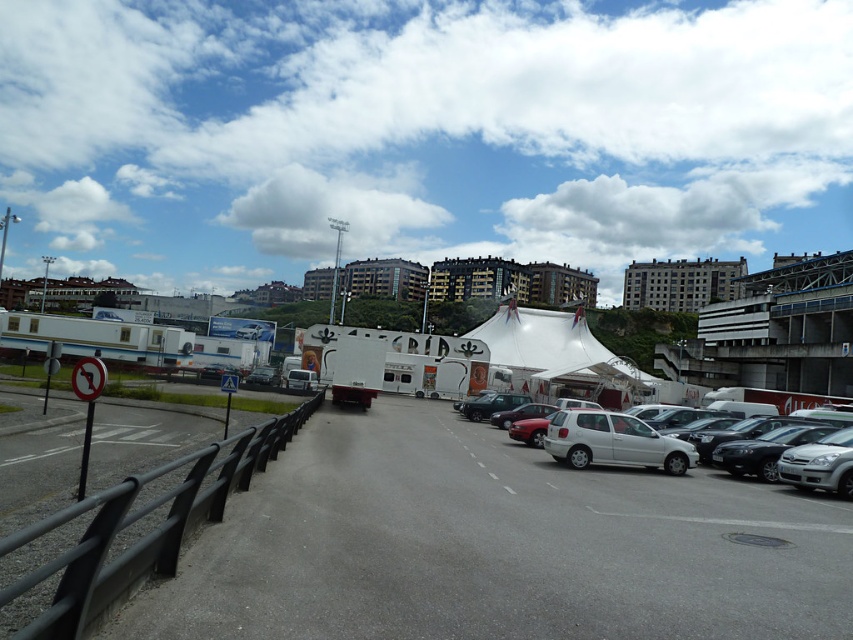
You are a delivery driver approaching the white matte hatchback at center and the matte red car at center parked on the road. Which vehicle should you stop behind to wait for your turn?

You should stop behind the matte red car at center because it is further away from you than the white matte hatchback at center, which is closer. This way, you maintain a proper distance and avoid blocking the hatchback.

You are driving a truck that is 2 meters wide and need to park your vehicle. You see a matte red car at center and a black matte van at center parked nearby. Which parking spot between them can accommodate your truck?

The black matte van at center is wider than the matte red car at center. Since your truck is 2 meters wide, you should choose the parking spot next to the black matte van at center as it likely has more space.